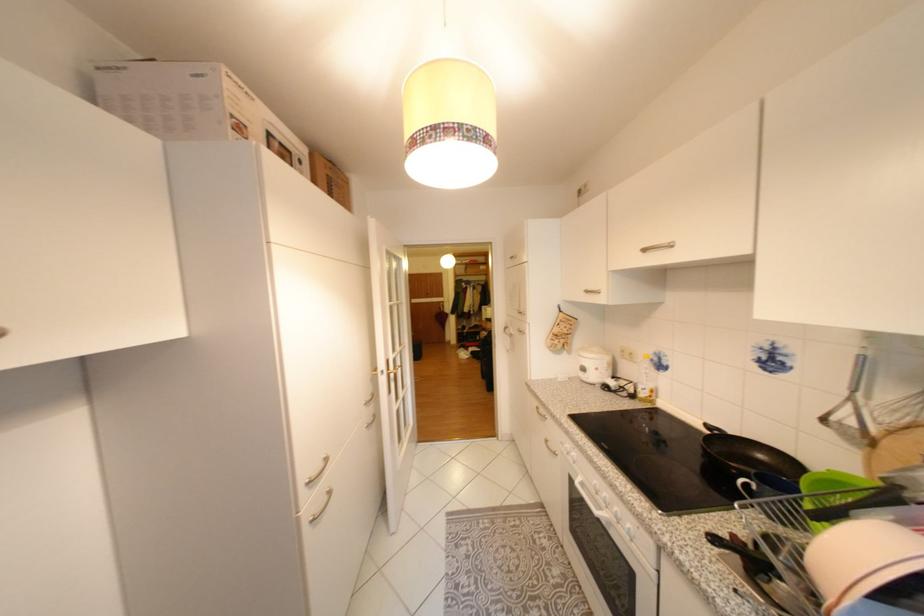
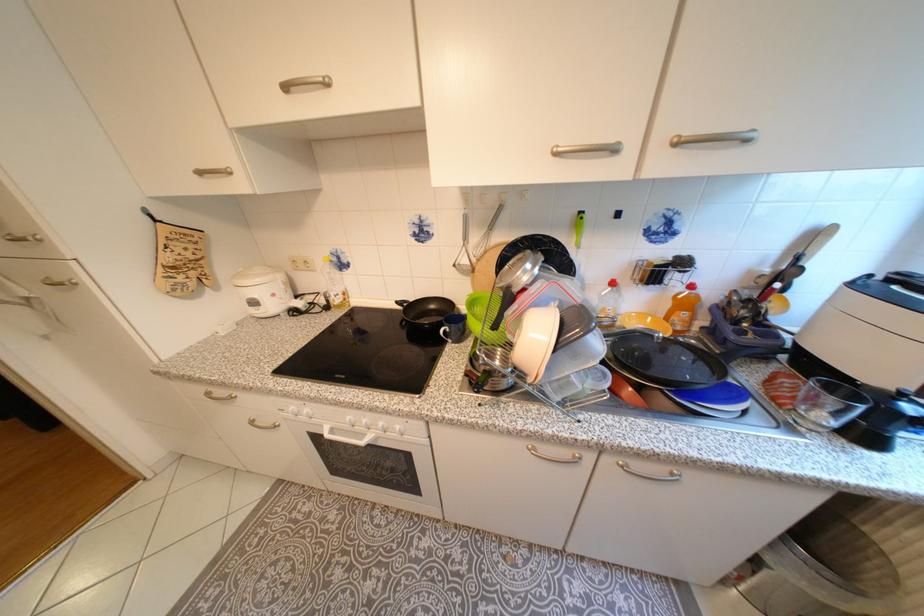
In the second image, find the point that corresponds to [530,314] in the first image.

(31, 240)